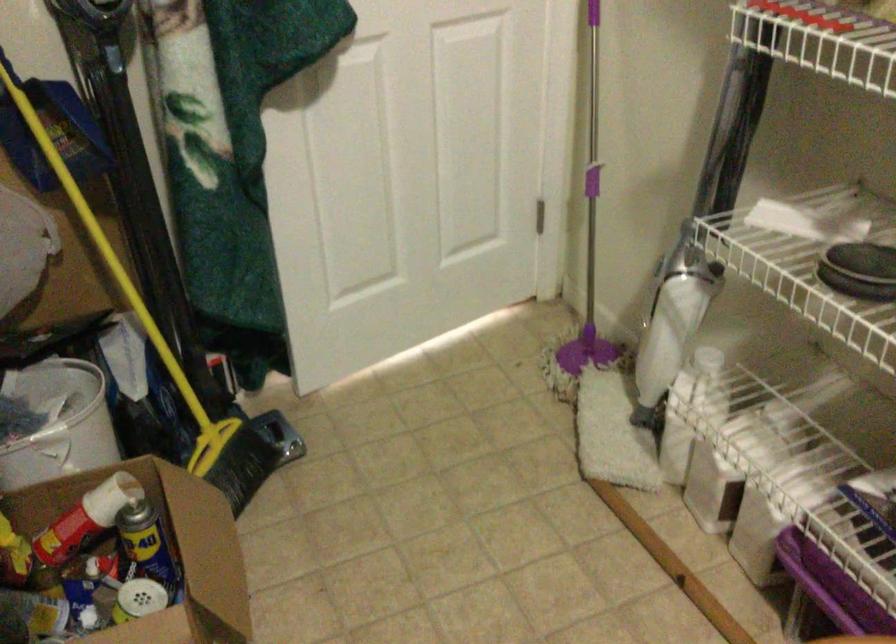
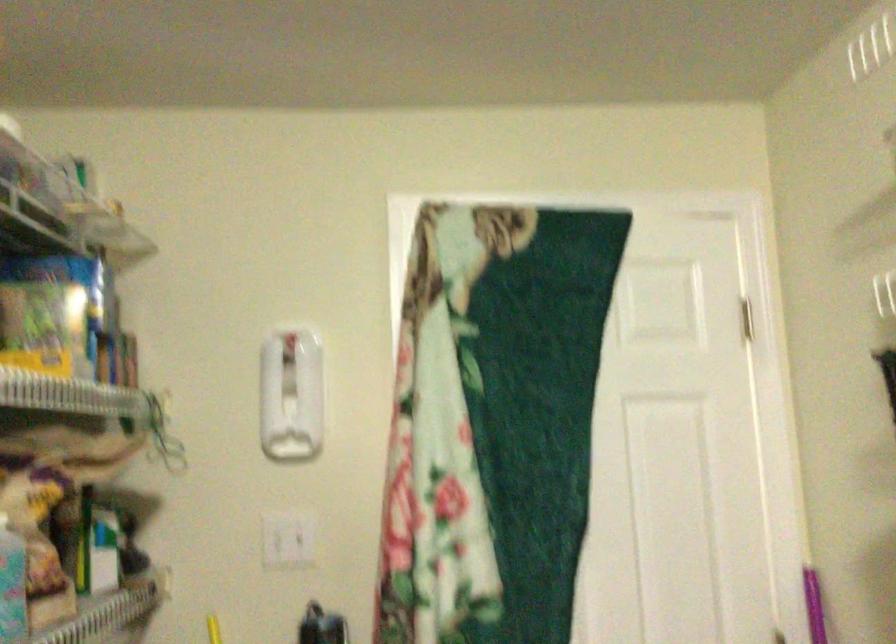
The first image is from the beginning of the video and the second image is from the end. How did the camera likely rotate when shooting the video?

The rotation direction of the camera is left-up.